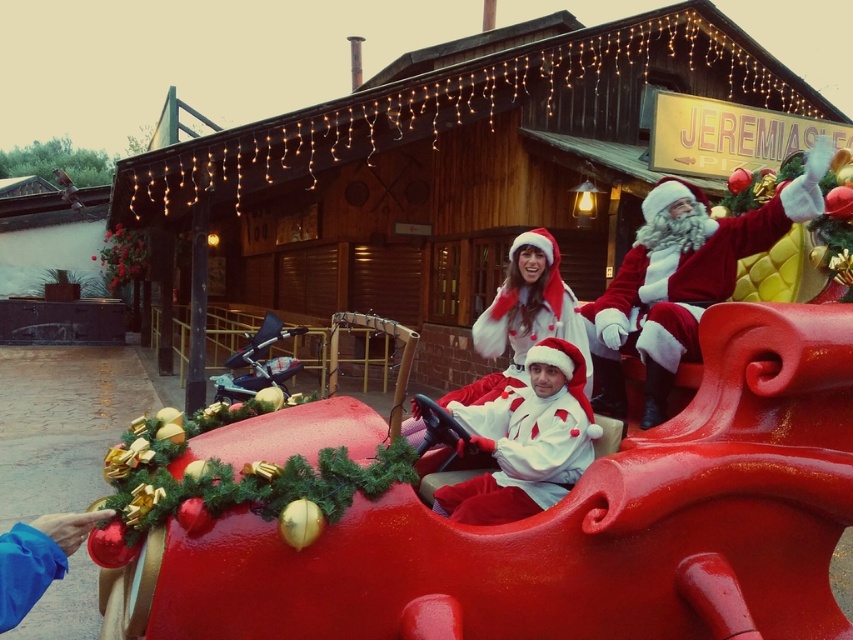
You are a photographer trying to capture both the velvet red santa at upper right and the matte white santa at center in a single shot. Which Santa should you focus on first to ensure the smaller one is in frame?

You should focus on the matte white santa at center first since it is smaller and needs to be positioned carefully to ensure it fits within the frame alongside the larger velvet red santa at upper right.

You are standing in front of the sleigh and want to determine the relative positions of two points marked on the image. Which point is closer to you, point (613, 353) or point (567, 438)?

Point (613, 353) is further to the camera than point (567, 438), so the point closer to you is point (567, 438).